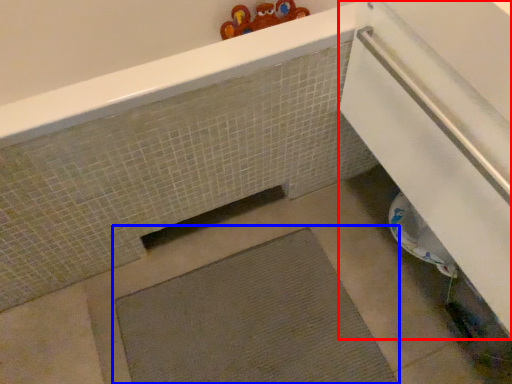
Question: Which of the following is the farthest to the observer, screen door (highlighted by a red box) or bath mat (highlighted by a blue box)?

Choices:
 (A) screen door
 (B) bath mat

Answer: (B)